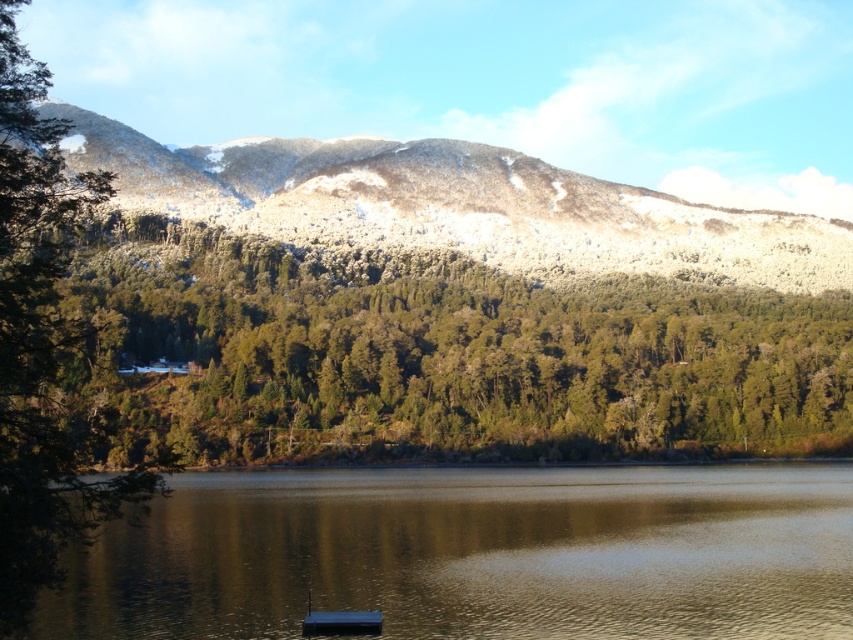
You are standing at the edge of the lake and want to walk towards the green textured trees at center. Which direction should you walk to avoid stepping on the smooth reflective water at center?

You should walk towards the green textured trees at center because they are positioned over the smooth reflective water at center, meaning the trees are on the same plane or above the water, so walking towards them would not involve stepping onto the water.

You are standing on the dock and want to know if the smooth reflective water at center can fully cover the metallic blue boat at lower center if the water level rises. Can it?

The smooth reflective water at center is wider than the metallic blue boat at lower center, so if the water level rises, the smooth reflective water at center can fully cover the metallic blue boat at lower center.